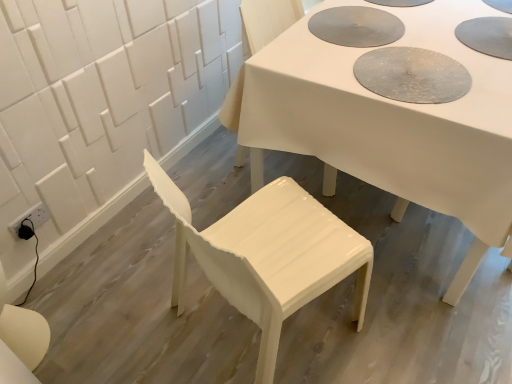
Describe the element at coordinates (268, 19) in the screenshot. The width and height of the screenshot is (512, 384). I see `white glossy chair at center, which ranks as the 1th chair in back-to-front order` at that location.

Measure the distance between point (481, 66) and camera.

A distance of 4.41 feet exists between point (481, 66) and camera.

Locate an element on the screen. This screenshot has height=384, width=512. white glossy table at center is located at coordinates (388, 125).

Locate an element on the screen. The height and width of the screenshot is (384, 512). glossy white chair at lower center, acting as the 2th chair starting from the top is located at coordinates (267, 255).

Is point (301, 253) behind point (254, 34)?

No, (301, 253) is in front of (254, 34).

From a real-world perspective, is glossy white chair at lower center, the first chair when ordered from front to back, located beneath white glossy chair at center, which ranks as the first chair in top-to-bottom order?

Yes.

Visually, is glossy white chair at lower center, which is the 1th chair from bottom to top, positioned to the left or to the right of white glossy chair at center, the second chair positioned from the bottom?

Based on their positions, glossy white chair at lower center, which is the 1th chair from bottom to top, is located to the left of white glossy chair at center, the second chair positioned from the bottom.

Based on the photo, between glossy white chair at lower center, which is the 1th chair from bottom to top, and white glossy chair at center, the second chair in the front-to-back sequence, which one has larger size?

Bigger between the two is glossy white chair at lower center, which is the 1th chair from bottom to top.

From a real-world perspective, which is physically below, white glossy table at center or glossy white chair at lower center, the first chair when ordered from front to back?

From a 3D spatial view, white glossy table at center is below.

Does white glossy table at center turn towards glossy white chair at lower center, the second chair viewed from the back?

No, white glossy table at center is not turned towards glossy white chair at lower center, the second chair viewed from the back.

Considering the relative sizes of white glossy table at center and glossy white chair at lower center, the second chair viewed from the back, in the image provided, is white glossy table at center thinner than glossy white chair at lower center, the second chair viewed from the back,?

No, white glossy table at center is not thinner than glossy white chair at lower center, the second chair viewed from the back.

Are white glossy table at center and glossy white chair at lower center, acting as the 2th chair starting from the top, far apart?

No.

Which of these two, white glossy table at center or white glossy chair at center, the second chair in the front-to-back sequence, stands taller?

white glossy chair at center, the second chair in the front-to-back sequence.

From the image's perspective, is white glossy table at center above or below white glossy chair at center, the second chair in the front-to-back sequence?

Based on their image positions, white glossy table at center is located above white glossy chair at center, the second chair in the front-to-back sequence.

At what (x,y) coordinates should I click in order to perform the action: click on table lying in front of the white glossy chair at center, which ranks as the first chair in top-to-bottom order. Please return your answer as a coordinate pair (x, y). The image size is (512, 384). Looking at the image, I should click on [388, 125].

Is white glossy table at center at the left side of white glossy chair at center, the second chair in the front-to-back sequence?

No, white glossy table at center is not to the left of white glossy chair at center, the second chair in the front-to-back sequence.

Is glossy white chair at lower center, the second chair viewed from the back, oriented away from white glossy table at center?

No.

Considering the sizes of objects glossy white chair at lower center, the first chair when ordered from front to back, and white glossy table at center in the image provided, who is thinner, glossy white chair at lower center, the first chair when ordered from front to back, or white glossy table at center?

With smaller width is glossy white chair at lower center, the first chair when ordered from front to back.

Does point (354, 238) appear closer or farther from the camera than point (270, 130)?

Clearly, point (354, 238) is closer to the camera than point (270, 130).

Is white glossy chair at center, which ranks as the first chair in top-to-bottom order, surrounding glossy white chair at lower center, acting as the 2th chair starting from the top?

No.

What's the angular difference between white glossy chair at center, the second chair positioned from the bottom, and glossy white chair at lower center, the second chair viewed from the back,'s facing directions?

The angular difference between white glossy chair at center, the second chair positioned from the bottom, and glossy white chair at lower center, the second chair viewed from the back, is 71.3 degrees.

I want to click on chair below the white glossy chair at center, which ranks as the 1th chair in back-to-front order (from the image's perspective), so click(x=267, y=255).

Is point (269, 13) positioned behind point (360, 265)?

Yes, it is behind point (360, 265).

Between white glossy chair at center, which ranks as the 1th chair in back-to-front order, and white glossy table at center, which one is positioned in front?

white glossy table at center.

Considering the sizes of objects white glossy chair at center, the second chair positioned from the bottom, and white glossy table at center in the image provided, who is wider, white glossy chair at center, the second chair positioned from the bottom, or white glossy table at center?

Wider between the two is white glossy table at center.

Who is taller, white glossy chair at center, the second chair in the front-to-back sequence, or white glossy table at center?

white glossy chair at center, the second chair in the front-to-back sequence, is taller.

Measure the distance from white glossy chair at center, which ranks as the 1th chair in back-to-front order, to white glossy table at center.

They are 21.10 inches apart.

I want to click on chair located below the white glossy chair at center, which ranks as the 1th chair in back-to-front order (from the image's perspective), so click(267, 255).

This screenshot has width=512, height=384. Identify the location of chair that is the 2nd object to the left of the white glossy table at center, starting at the anchor. (267, 255).

Looking at the image, which one is located closer to white glossy table at center, white glossy chair at center, which ranks as the first chair in top-to-bottom order, or glossy white chair at lower center, the first chair when ordered from front to back?

Based on the image, glossy white chair at lower center, the first chair when ordered from front to back, appears to be nearer to white glossy table at center.

Considering their positions, is glossy white chair at lower center, which is the 1th chair from bottom to top, positioned further to white glossy table at center than white glossy chair at center, the second chair positioned from the bottom?

white glossy chair at center, the second chair positioned from the bottom, is further to white glossy table at center.

From the image, which object appears to be farther from white glossy chair at center, the second chair positioned from the bottom, white glossy table at center or glossy white chair at lower center, the second chair viewed from the back?

Based on the image, glossy white chair at lower center, the second chair viewed from the back, appears to be further to white glossy chair at center, the second chair positioned from the bottom.

Based on their spatial positions, is glossy white chair at lower center, the second chair viewed from the back, or white glossy table at center closer to white glossy chair at center, which ranks as the 1th chair in back-to-front order?

white glossy table at center is closer to white glossy chair at center, which ranks as the 1th chair in back-to-front order.

From the image, which object appears to be nearer to glossy white chair at lower center, the first chair when ordered from front to back, white glossy chair at center, the second chair in the front-to-back sequence, or white glossy table at center?

white glossy table at center.

Estimate the real-world distances between objects in this image. Which object is closer to glossy white chair at lower center, the second chair viewed from the back, white glossy table at center or white glossy chair at center, which ranks as the 1th chair in back-to-front order?

Based on the image, white glossy table at center appears to be nearer to glossy white chair at lower center, the second chair viewed from the back.

Identify the location of chair between glossy white chair at lower center, the first chair when ordered from front to back, and white glossy table at center from left to right. Image resolution: width=512 pixels, height=384 pixels. (268, 19).